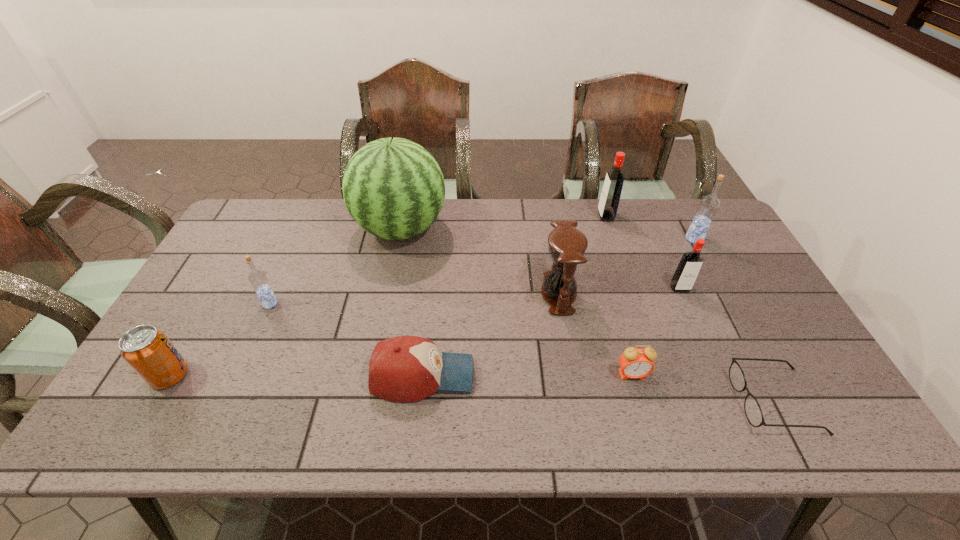
Where is `vacant region at the near edge of the desktop`? vacant region at the near edge of the desktop is located at coordinates (671, 443).

Where is `free space at the left edge of the desktop`? free space at the left edge of the desktop is located at coordinates (225, 291).

The image size is (960, 540). What are the coordinates of `vacant space at the right edge` in the screenshot? It's located at (768, 348).

In the image, there is a desktop. Where is `vacant space at the far left corner`? vacant space at the far left corner is located at coordinates 250,239.

In the image, there is a desktop. At what (x,y) coordinates should I click in order to perform the action: click on vacant space at the near left corner. Please return your answer as a coordinate pair (x, y). This screenshot has width=960, height=540. Looking at the image, I should click on (168, 441).

In the image, there is a desktop. Find the location of `vacant area at the near right corner`. vacant area at the near right corner is located at coordinates (836, 422).

In order to click on vacant area between the spectacles and the nearest vodka in this screenshot , I will do `click(522, 352)`.

Where is `empty space that is in between the rightmost vodka and the left blue vodka`? The image size is (960, 540). empty space that is in between the rightmost vodka and the left blue vodka is located at coordinates (482, 271).

Identify the location of vacant space that is in between the left blue vodka and the brown hourglass. The height and width of the screenshot is (540, 960). (415, 299).

Find the location of `free spot between the hourglass and the smaller red vodka`. free spot between the hourglass and the smaller red vodka is located at coordinates (619, 291).